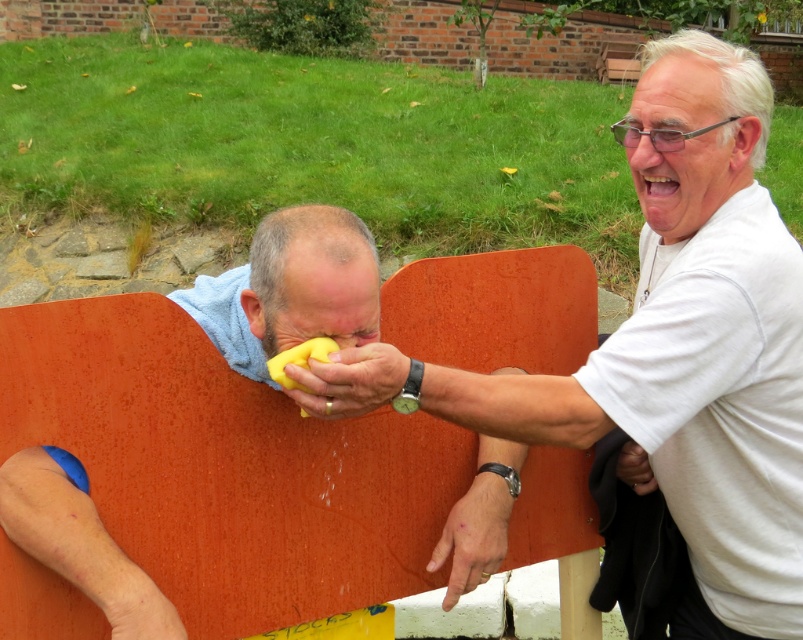
You are standing in the garden and want to place a small decoration between the two points, point (x=434, y=349) and point (x=561, y=381). Which point is closer to you to place the decoration?

Point (x=434, y=349) is closer to you than point (x=561, y=381), so place the decoration near point (x=434, y=349).

You are a maintenance worker in the park. You need to place a yellow rubber duck at center on the orange painted wood park bench at center. The duck is 3 inches wide. Is there enough space between them to place the duck?

The distance between the orange painted wood park bench at center and the yellow rubber duck at center is 12.33 inches. Since the duck is only 3 inches wide, there is sufficient space to place it between them.

You are standing at the point marked by coordinates point (227, 467) in the park. What object are you standing on?

The point (227, 467) marks the orange painted wood park bench at center, so you are standing on the orange painted wood park bench at center.